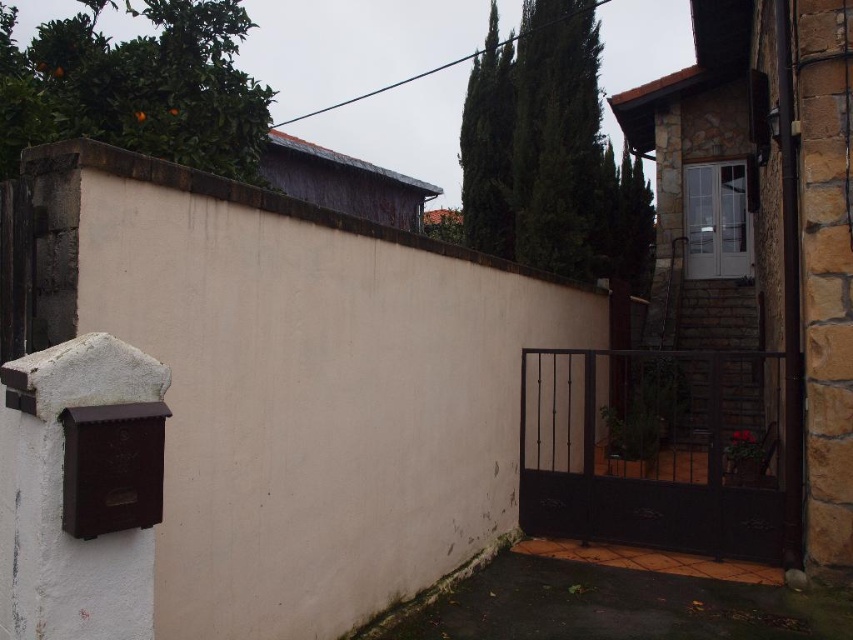
Question: Among these points, which one is farthest from the camera?

Choices:
 (A) (560, 141)
 (B) (119, 54)

Answer: (A)

Question: Does green leafy cypress tree at upper center lie behind green leafy cypress at upper left?

Choices:
 (A) no
 (B) yes

Answer: (B)

Question: Which point is closer to the camera taking this photo?

Choices:
 (A) [x=538, y=136]
 (B) [x=202, y=54]

Answer: (B)

Question: Does green leafy cypress tree at upper center have a larger size compared to green leafy cypress at upper left?

Choices:
 (A) no
 (B) yes

Answer: (A)

Question: Is green leafy cypress tree at upper center positioned behind green leafy cypress at upper left?

Choices:
 (A) yes
 (B) no

Answer: (A)

Question: Among these points, which one is farthest from the camera?

Choices:
 (A) (219, 128)
 (B) (606, 208)

Answer: (B)